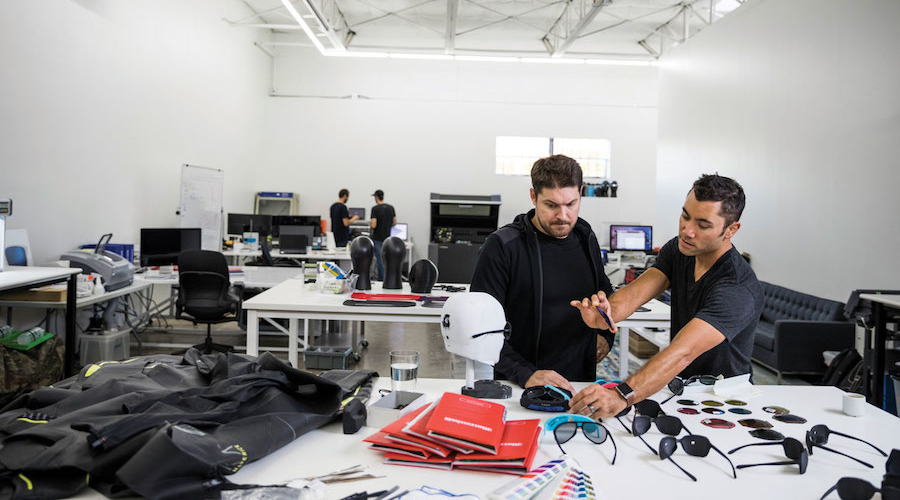
Find the location of a particular element. couch is located at coordinates (799, 317).